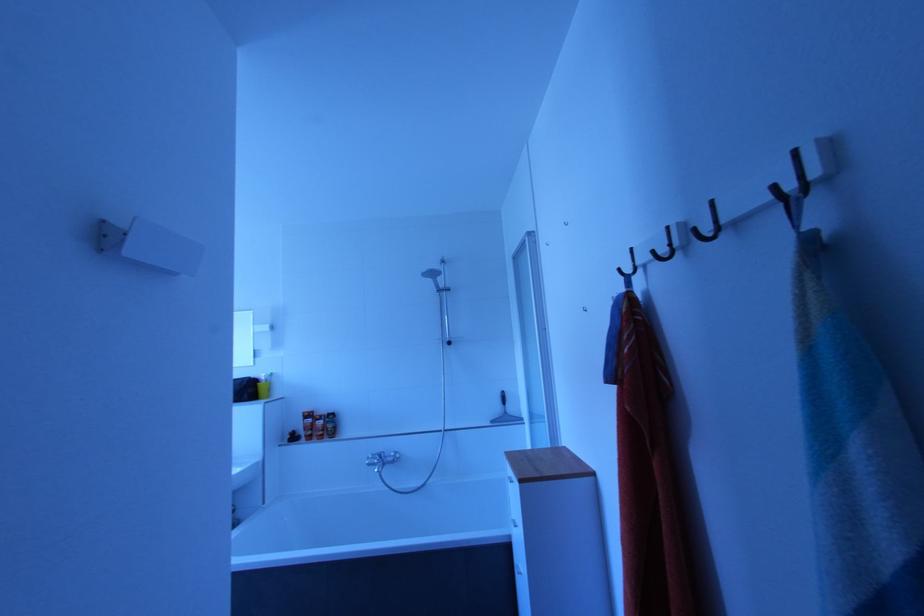
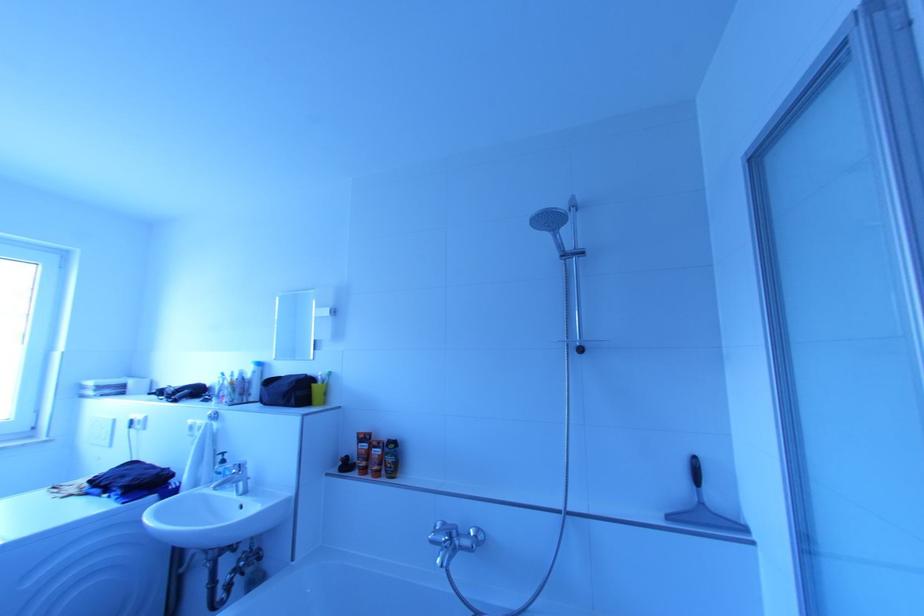
Question: In a continuous first-person perspective shot, in which direction is the camera moving?

Choices:
 (A) Left
 (B) Right
 (C) Forward
 (D) Backward

Answer: (C)